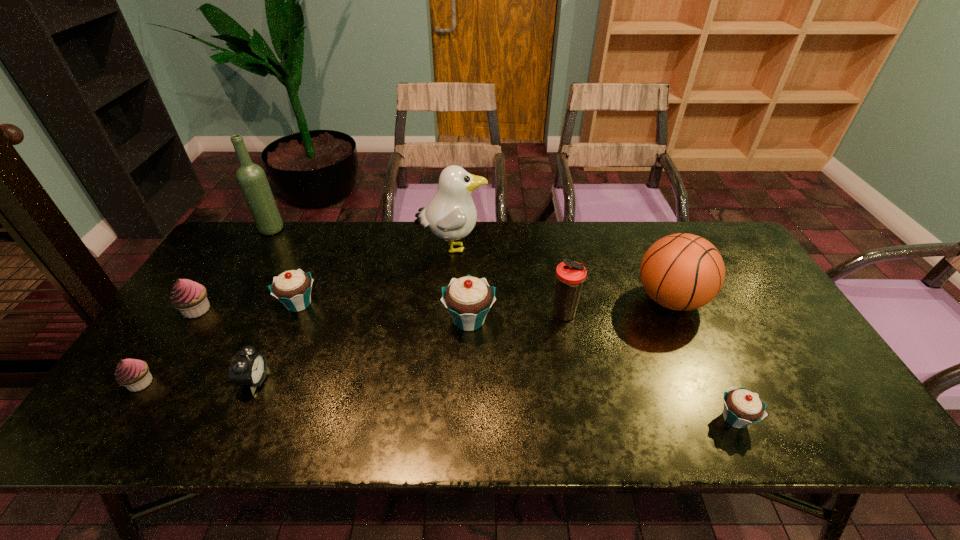
Locate an element on the screen. This screenshot has width=960, height=540. vacant area that lies between the alarm clock and the leftmost teal cupcake is located at coordinates (276, 342).

Identify the location of unoccupied area between the white gull and the nearer pink cupcake. The height and width of the screenshot is (540, 960). (297, 315).

I want to click on free point between the wine bottle and the rightmost cupcake, so click(503, 324).

The width and height of the screenshot is (960, 540). What are the coordinates of `vacant space that's between the smallest teal cupcake and the green wine bottle` in the screenshot? It's located at (503, 324).

Find the location of a particular element. This screenshot has height=540, width=960. vacant area between the nearer pink cupcake and the leftmost teal cupcake is located at coordinates [220, 343].

This screenshot has height=540, width=960. I want to click on vacant area that lies between the thermos bottle and the green wine bottle, so click(x=419, y=272).

The image size is (960, 540). In order to click on object that is the second nearest to the smaller pink cupcake in this screenshot , I will do `click(248, 368)`.

Find the location of `object that stands as the eighth closest to the nearer pink cupcake`. object that stands as the eighth closest to the nearer pink cupcake is located at coordinates (682, 271).

Identify which cupcake is the fourth nearest to the bigger pink cupcake. Please provide its 2D coordinates. Your answer should be formatted as a tuple, i.e. [(x, y)], where the tuple contains the x and y coordinates of a point satisfying the conditions above.

[(741, 407)]

At what (x,y) coordinates should I click in order to perform the action: click on cupcake that is the closest to the wine bottle. Please return your answer as a coordinate pair (x, y). This screenshot has width=960, height=540. Looking at the image, I should click on (292, 288).